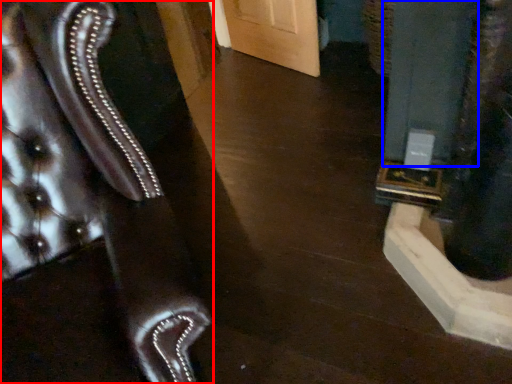
Question: Which object appears closest to the camera in this image, furniture (highlighted by a red box) or pillar (highlighted by a blue box)?

Choices:
 (A) furniture
 (B) pillar

Answer: (A)